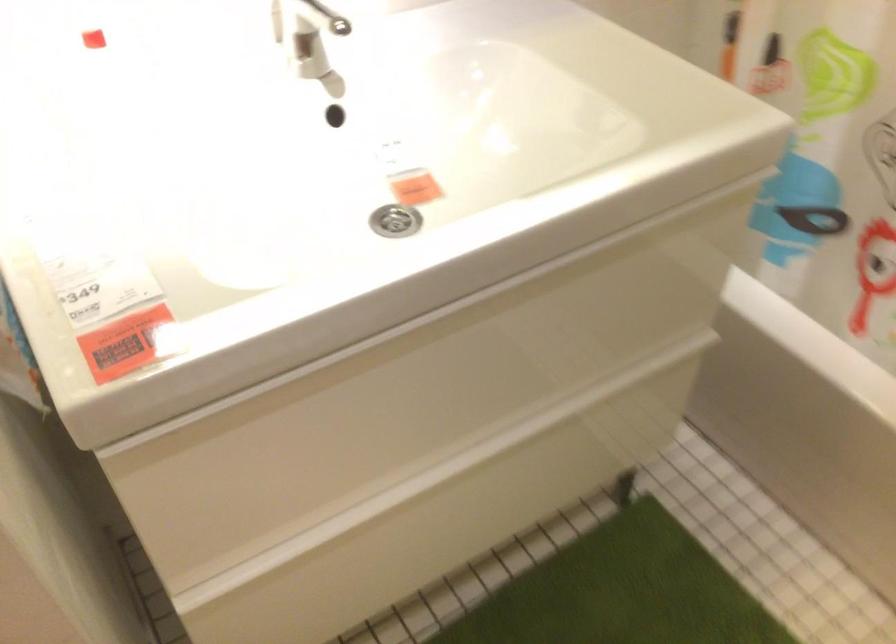
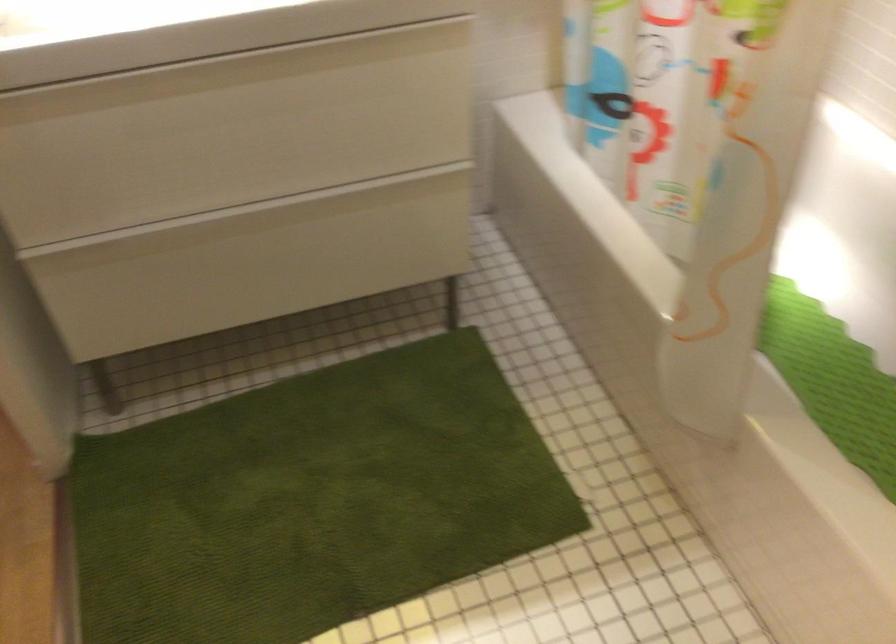
Question: The camera is either moving clockwise (left) or counter-clockwise (right) around the object. The first image is from the beginning of the video and the second image is from the end. Is the camera moving left or right when shooting the video?

Choices:
 (A) Left
 (B) Right

Answer: (B)